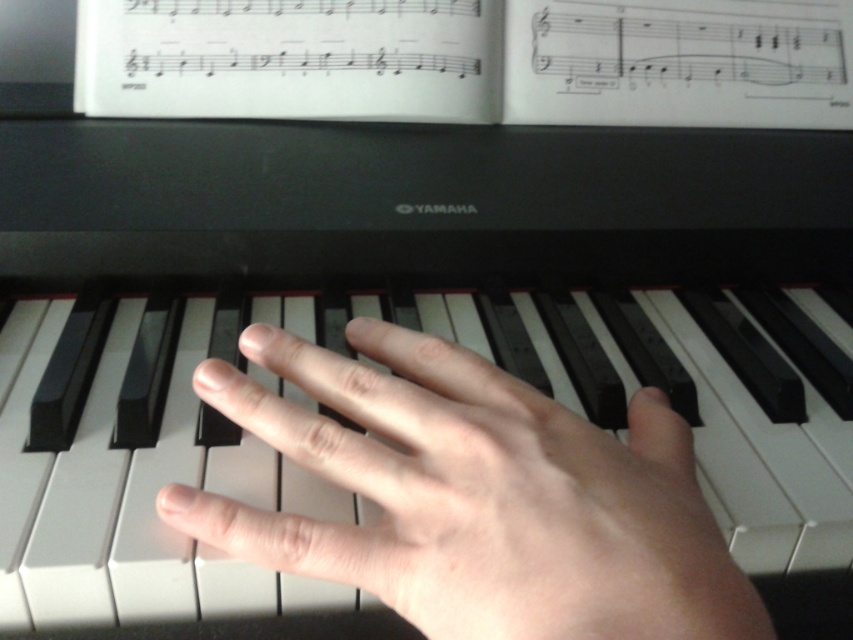
Is smooth skin hand at center shorter than white paper at upper center?

Indeed, smooth skin hand at center has a lesser height compared to white paper at upper center.

Who is positioned more to the left, smooth skin hand at center or white paper at upper center?

Positioned to the left is smooth skin hand at center.

Between point (624, 632) and point (572, 81), which one is positioned in front?

Point (624, 632)

The width and height of the screenshot is (853, 640). Find the location of `smooth skin hand at center`. smooth skin hand at center is located at coordinates (477, 497).